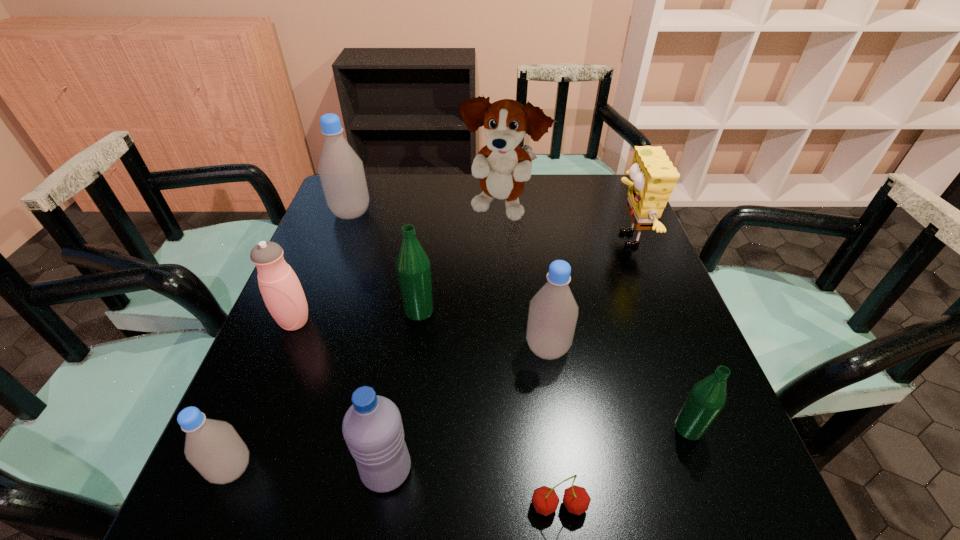
This screenshot has height=540, width=960. Find the location of `the nearer green bottle`. the nearer green bottle is located at coordinates (707, 398).

Find the location of a particular element. the smaller green bottle is located at coordinates (707, 398).

What are the coordinates of `the nearest bottle` in the screenshot? It's located at (213, 447).

Where is `the nearest gray bottle`? This screenshot has height=540, width=960. the nearest gray bottle is located at coordinates (213, 447).

Where is `cherry`? The image size is (960, 540). cherry is located at coordinates (576, 499).

Where is `free location located on the face of the brown puppy`? free location located on the face of the brown puppy is located at coordinates (503, 247).

Locate an element on the screen. free point located on the right of the farthest gray bottle is located at coordinates point(402,213).

Identify the location of blank area located on the front-facing side of the sponge. Image resolution: width=960 pixels, height=540 pixels. (560, 239).

Find the location of `free space located 0.370m on the front-facing side of the sponge`. free space located 0.370m on the front-facing side of the sponge is located at coordinates (474, 239).

Where is `free space located on the front-facing side of the sponge`? The image size is (960, 540). free space located on the front-facing side of the sponge is located at coordinates (535, 239).